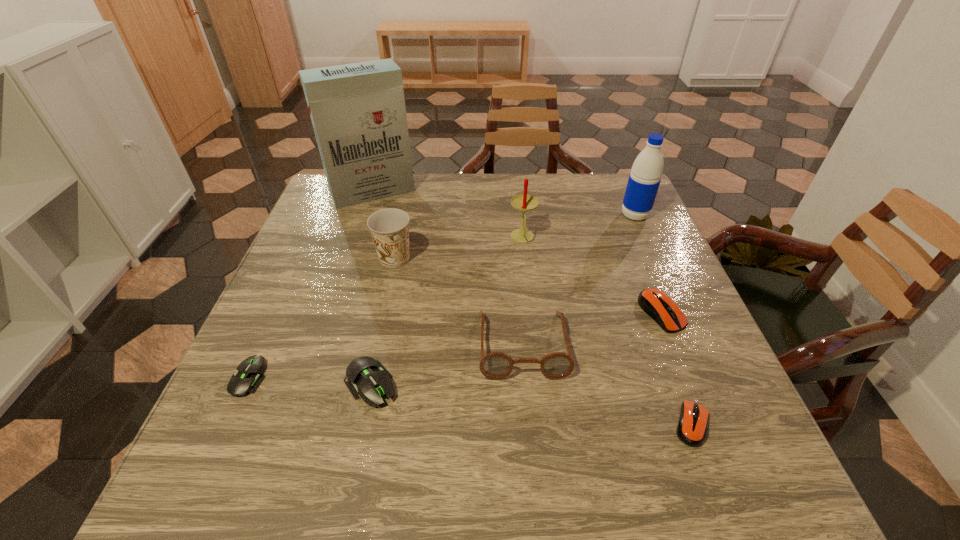
The height and width of the screenshot is (540, 960). Identify the location of free region that satisfies the following two spatial constraints: 1. on the back side of the right gray computer mouse; 2. on the left side of the bigger orange computer mouse. (386, 313).

At what (x,y) coordinates should I click in order to perform the action: click on free location that satisfies the following two spatial constraints: 1. on the front-facing side of the nearer orange computer mouse; 2. on the left side of the spectacles. Please return your answer as a coordinate pair (x, y). This screenshot has height=540, width=960. Looking at the image, I should click on click(x=530, y=424).